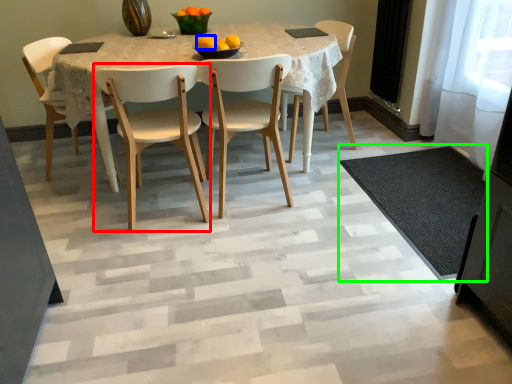
Question: Estimate the real-world distances between objects in this image. Which object is farther from chair (highlighted by a red box), orange (highlighted by a blue box) or doormat (highlighted by a green box)?

Choices:
 (A) orange
 (B) doormat

Answer: (B)